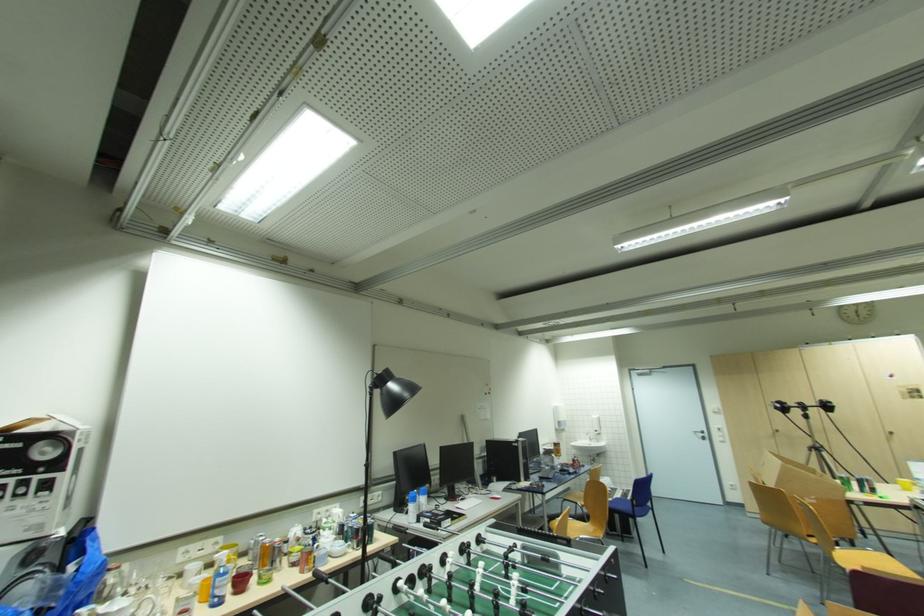
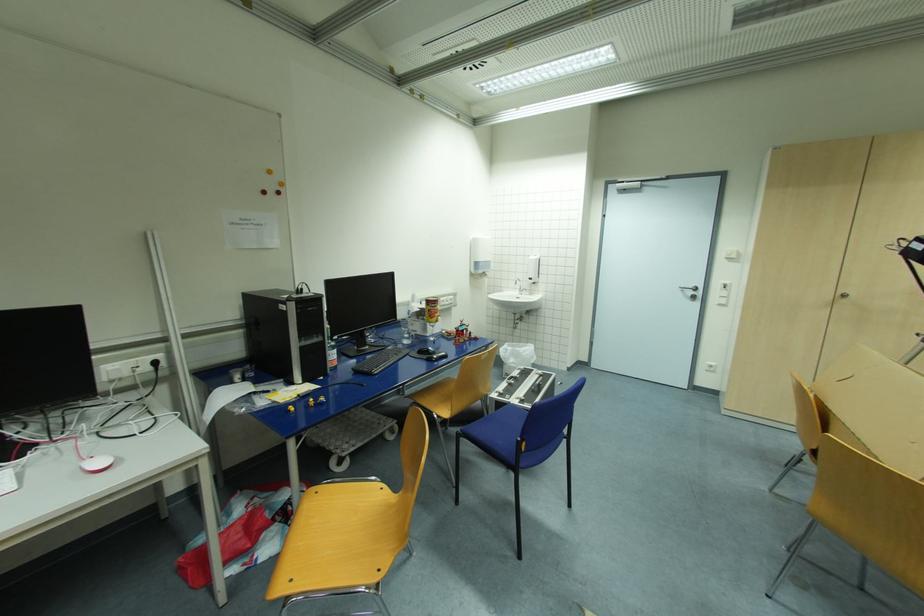
Find the pixel in the second image that matches pixel 781 431 in the first image.

(847, 296)